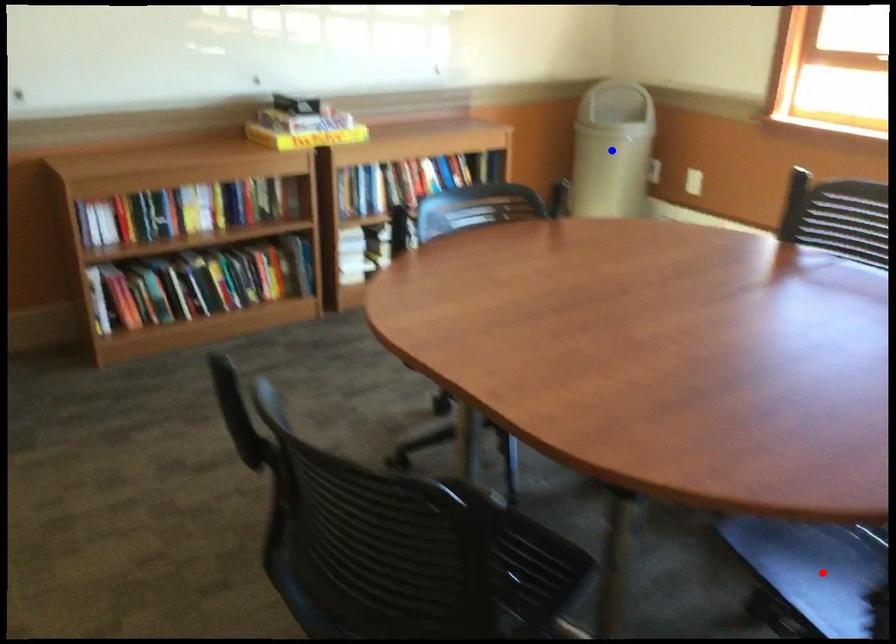
Question: Two points are marked on the image. Which point is closer to the camera?

Choices:
 (A) Blue point is closer.
 (B) Red point is closer.

Answer: (B)